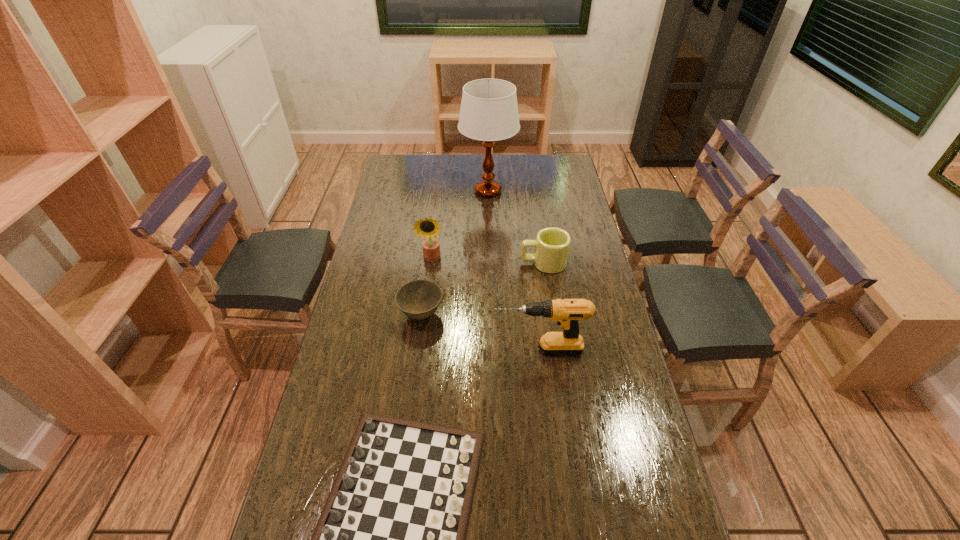
The width and height of the screenshot is (960, 540). Identify the location of vacant position at the left edge of the desktop. (390, 184).

Find the location of a particular element. The width and height of the screenshot is (960, 540). free point at the right edge is located at coordinates (588, 240).

Where is `vacant point at the far right corner`? vacant point at the far right corner is located at coordinates (542, 166).

Locate an element on the screen. empty space between the second shortest object and the tallest object is located at coordinates (455, 253).

The height and width of the screenshot is (540, 960). I want to click on unoccupied area between the fifth tallest object and the tallest object, so click(455, 253).

This screenshot has width=960, height=540. What are the coordinates of `free space between the sunflower and the drill` in the screenshot? It's located at (485, 304).

This screenshot has height=540, width=960. I want to click on object that can be found as the second closest to the fourth farthest object, so click(567, 312).

This screenshot has height=540, width=960. Identify the location of object that stands as the second closest to the fifth farthest object. (390, 539).

Where is `vacant area in the image that satisfies the following two spatial constraints: 1. on the back side of the farthest object; 2. on the right side of the second shortest object`? vacant area in the image that satisfies the following two spatial constraints: 1. on the back side of the farthest object; 2. on the right side of the second shortest object is located at coordinates (437, 191).